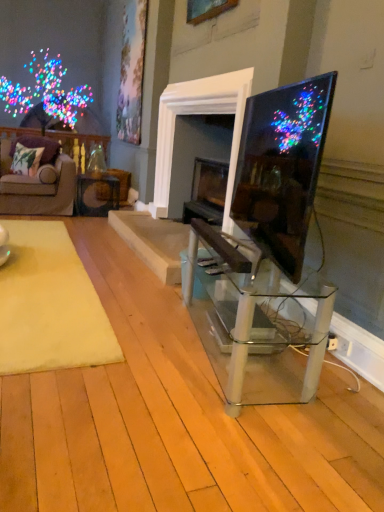
Question: From a real-world perspective, is clear glass table at center, positioned as the 2th table in back-to-front order, positioned above or below green floral fabric pillow at left?

Choices:
 (A) above
 (B) below

Answer: (B)

Question: Considering the positions of clear glass table at center, acting as the second table starting from the left, and green floral fabric pillow at left in the image, is clear glass table at center, acting as the second table starting from the left, bigger or smaller than green floral fabric pillow at left?

Choices:
 (A) big
 (B) small

Answer: (A)

Question: Which of these objects is positioned farthest from the matte black tv at right?

Choices:
 (A) yellow plush rug at lower left
 (B) clear glass table at center, acting as the second table starting from the left
 (C) matte black table at center, the first table from the left
 (D) velvet purple couch at left
 (E) green floral fabric pillow at left

Answer: (E)

Question: Based on their relative distances, which object is farther from the yellow plush rug at lower left?

Choices:
 (A) velvet purple couch at left
 (B) clear glass table at center, the 2th table from the top
 (C) matte black tv at right
 (D) matte black table at center, placed as the 1th table when sorted from back to front
 (E) green floral fabric pillow at left

Answer: (E)